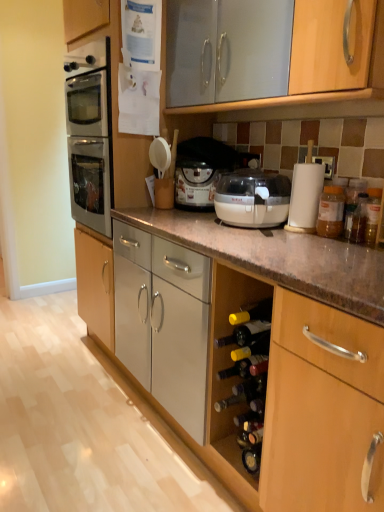
Question: Based on their sizes in the image, would you say translucent plastic jar at right is bigger or smaller than translucent yellow glass wine bottle at lower center?

Choices:
 (A) small
 (B) big

Answer: (B)

Question: Relative to translucent yellow glass wine bottle at lower center, is translucent plastic jar at right in front or behind?

Choices:
 (A) front
 (B) behind

Answer: (B)

Question: Which is farther from the beige plastic food processor at center?

Choices:
 (A) translucent plastic jar at right
 (B) matte white food processor at center
 (C) translucent yellow glass wine bottle at lower center

Answer: (C)

Question: Considering the real-world distances, which object is farthest from the beige plastic food processor at center?

Choices:
 (A) translucent yellow glass wine bottle at lower center
 (B) matte white food processor at center
 (C) translucent plastic jar at right

Answer: (A)